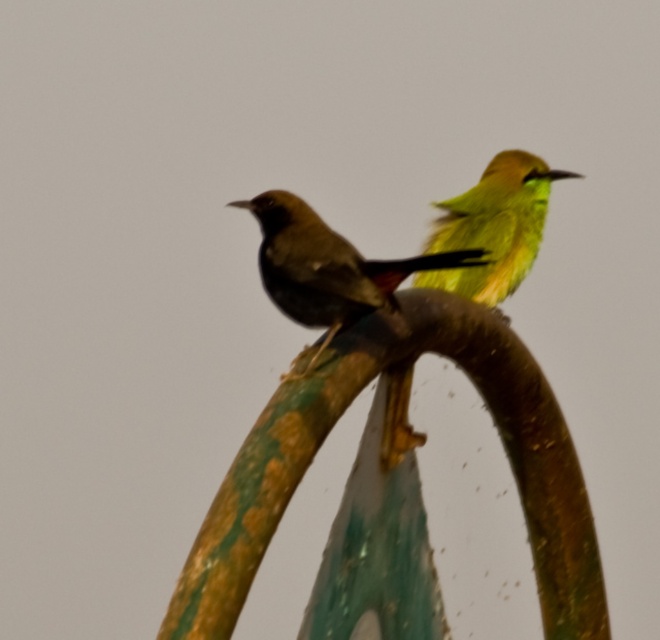
Is the position of shiny black bird at center less distant than that of green matte parrot at upper right?

That is True.

Which of these two, shiny black bird at center or green matte parrot at upper right, stands taller?

green matte parrot at upper right

Is point (273, 225) more distant than point (521, 180)?

That is False.

I want to click on shiny black bird at center, so click(327, 268).